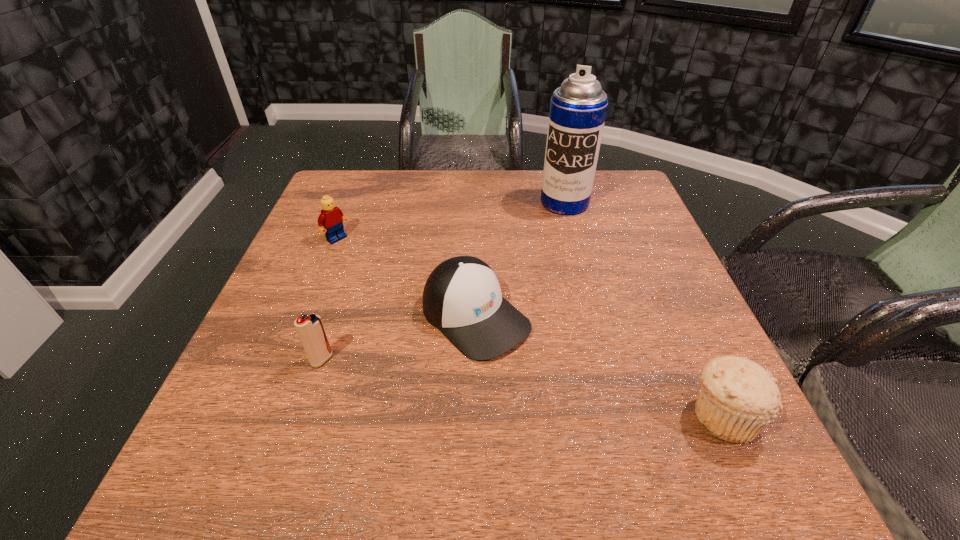
Find the location of a particular element. The image size is (960, 540). object that is at the near edge is located at coordinates (738, 399).

At what (x,y) coordinates should I click in order to perform the action: click on igniter that is at the left edge. Please return your answer as a coordinate pair (x, y). This screenshot has height=540, width=960. Looking at the image, I should click on (310, 329).

The image size is (960, 540). What are the coordinates of `Lego that is at the left edge` in the screenshot? It's located at (331, 220).

Identify the location of muffin situated at the right edge. (738, 399).

The height and width of the screenshot is (540, 960). Find the location of `aerosol can that is positioned at the right edge`. aerosol can that is positioned at the right edge is located at coordinates (578, 108).

Find the location of a particular element. This screenshot has height=540, width=960. object present at the far right corner is located at coordinates (578, 108).

Identify the location of object present at the near right corner. This screenshot has width=960, height=540. (738, 399).

You are a GUI agent. You are given a task and a screenshot of the screen. Output one action in this format:
    pyautogui.click(x=<x>, y=<y>)
    Task: Click on the free space at the far edge of the desktop
    The width and height of the screenshot is (960, 540).
    Given the screenshot: What is the action you would take?
    pyautogui.click(x=452, y=194)

In the image, there is a desktop. Identify the location of free space at the near edge. (334, 389).

Image resolution: width=960 pixels, height=540 pixels. What are the coordinates of `free space at the left edge` in the screenshot? It's located at (313, 285).